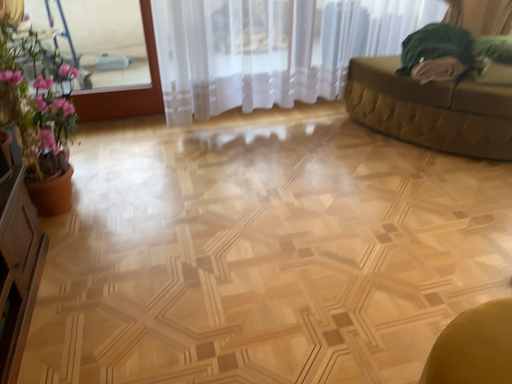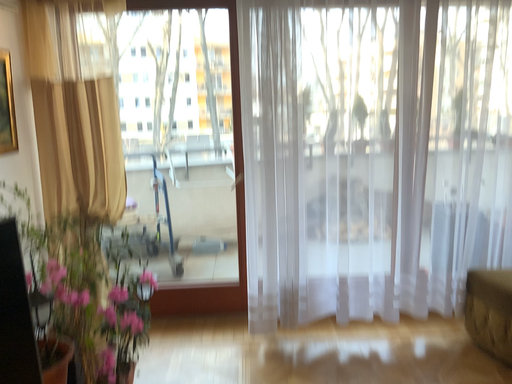
Question: How did the camera likely rotate when shooting the video?

Choices:
 (A) rotated left
 (B) rotated right

Answer: (A)